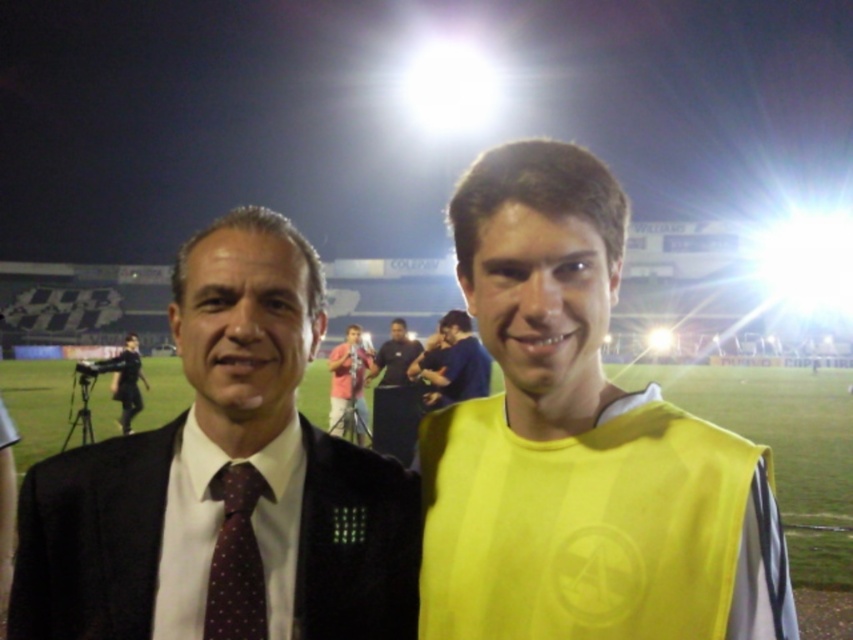
Question: Considering the real-world distances, which object is farthest from the yellow fabric vest at right?

Choices:
 (A) pink fabric at center
 (B) black fabric shirt at center
 (C) yellow jersey at center
 (D) dark blue uniform at left

Answer: (D)

Question: Does pink fabric at center have a smaller size compared to dark blue uniform at left?

Choices:
 (A) yes
 (B) no

Answer: (A)

Question: Which point is closer to the camera?

Choices:
 (A) (126, 365)
 (B) (451, 344)

Answer: (B)

Question: Does dark maroon dotted tie at left appear on the left side of matte black shirt at center?

Choices:
 (A) yes
 (B) no

Answer: (B)

Question: From the image, what is the correct spatial relationship of black fabric shirt at center in relation to dark blue uniform at left?

Choices:
 (A) below
 (B) above

Answer: (B)

Question: Which point is farther to the camera?

Choices:
 (A) matte black shirt at center
 (B) yellow fabric vest at right

Answer: (A)